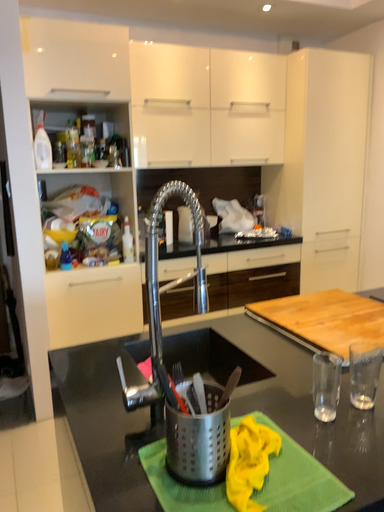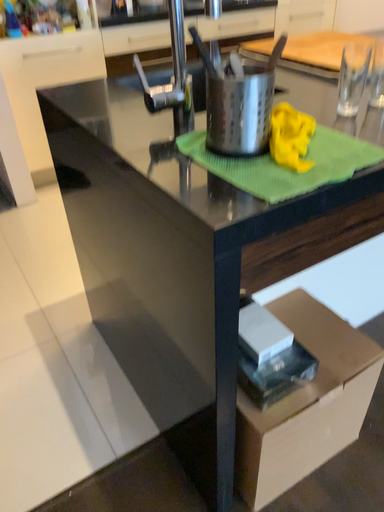
Question: How did the camera likely rotate when shooting the video?

Choices:
 (A) rotated left
 (B) rotated right

Answer: (B)